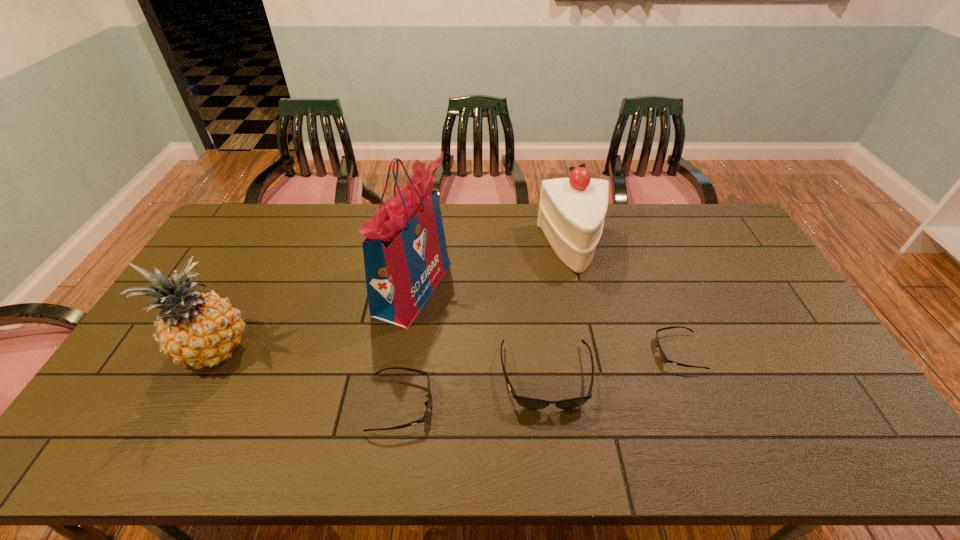
Considering the uniform spacing of sunglassess, where should an additional sunglasses be positioned on the right? Please locate a free spot. Please provide its 2D coordinates. Your answer should be formatted as a tuple, i.e. [(x, y)], where the tuple contains the x and y coordinates of a point satisfying the conditions above.

[(798, 329)]